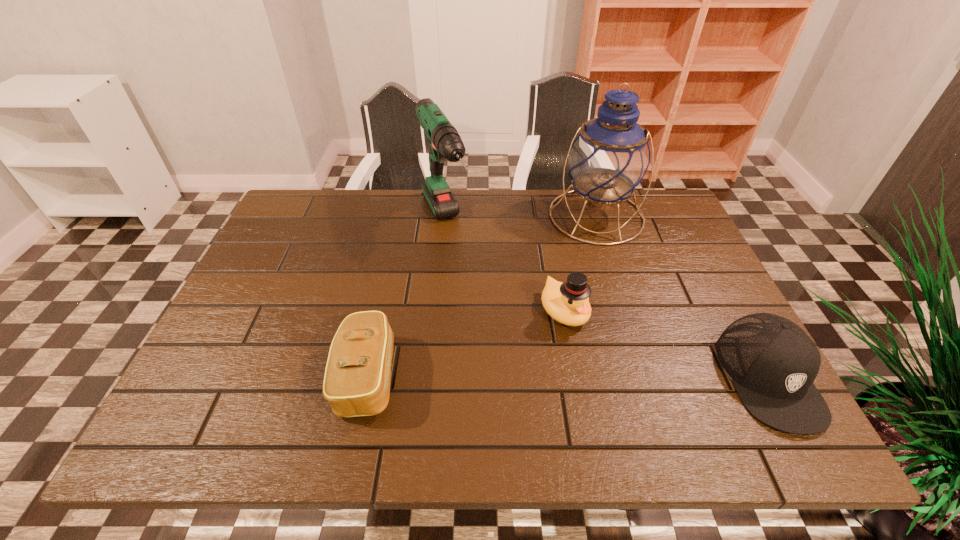
Identify the location of lantern present at the right edge. (610, 157).

Locate an element on the screen. The height and width of the screenshot is (540, 960). object present at the far right corner is located at coordinates point(610,157).

Where is `object located in the near right corner section of the desktop`? This screenshot has height=540, width=960. object located in the near right corner section of the desktop is located at coordinates (773, 363).

Identify the location of free space at the far edge. Image resolution: width=960 pixels, height=540 pixels. (622, 238).

Find the location of `free space at the near edge of the desktop`. free space at the near edge of the desktop is located at coordinates (405, 385).

Find the location of `vacant space at the left edge of the desktop`. vacant space at the left edge of the desktop is located at coordinates (262, 266).

What are the coordinates of `vacant region at the right edge of the desktop` in the screenshot? It's located at (671, 276).

The width and height of the screenshot is (960, 540). Identify the location of vacant space at the far left corner. (295, 206).

At what (x,y) coordinates should I click in order to perform the action: click on free spot at the far right corner of the desktop. Please return your answer as a coordinate pair (x, y). Looking at the image, I should click on click(x=661, y=217).

Locate an element on the screen. free spot between the rightmost object and the lantern is located at coordinates (683, 296).